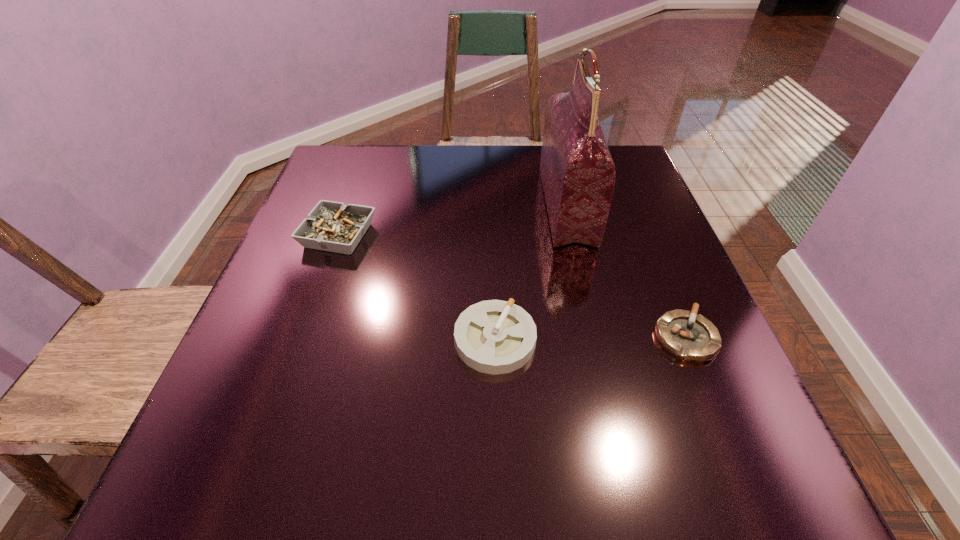
The width and height of the screenshot is (960, 540). I want to click on empty space between the shortest object and the handbag, so click(626, 272).

The height and width of the screenshot is (540, 960). Identify the location of vacant space in between the shortest ashtray and the leftmost ashtray. (512, 286).

At what (x,y) coordinates should I click in order to perform the action: click on free spot between the third object from right to left and the rightmost ashtray. Please return your answer as a coordinate pair (x, y). The height and width of the screenshot is (540, 960). Looking at the image, I should click on (590, 339).

What are the coordinates of `unoccupied area between the handbag and the leftmost ashtray` in the screenshot? It's located at (452, 221).

Where is `object that ranks as the third closest to the second ashtray from right to left`? Image resolution: width=960 pixels, height=540 pixels. object that ranks as the third closest to the second ashtray from right to left is located at coordinates (331, 226).

You are a GUI agent. You are given a task and a screenshot of the screen. Output one action in this format:
    pyautogui.click(x=<x>, y=<y>)
    Task: Click on the object that is the closest to the leftmost ashtray
    
    Given the screenshot: What is the action you would take?
    pyautogui.click(x=495, y=337)

Choose which ashtray is the nearest neighbor to the leftmost object. Please provide its 2D coordinates. Your answer should be formatted as a tuple, i.e. [(x, y)], where the tuple contains the x and y coordinates of a point satisfying the conditions above.

[(495, 337)]

Identify which ashtray is located as the second nearest to the second ashtray from right to left. Please provide its 2D coordinates. Your answer should be formatted as a tuple, i.e. [(x, y)], where the tuple contains the x and y coordinates of a point satisfying the conditions above.

[(331, 226)]

Locate an element on the screen. Image resolution: width=960 pixels, height=540 pixels. free region that satisfies the following two spatial constraints: 1. on the front-facing side of the rightmost object; 2. on the right side of the third object from left to right is located at coordinates (597, 338).

Locate an element on the screen. This screenshot has width=960, height=540. blank space that satisfies the following two spatial constraints: 1. on the front-facing side of the handbag; 2. on the left side of the rightmost object is located at coordinates (597, 338).